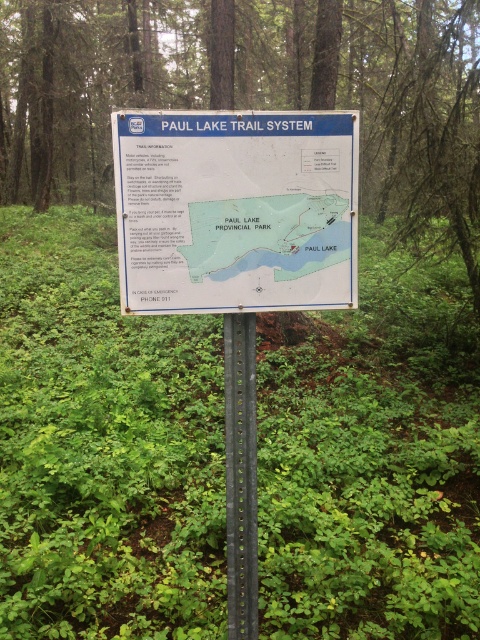
Question: Among these points, which one is farthest from the camera?

Choices:
 (A) (213, 220)
 (B) (97, 157)
 (C) (131, 292)
 (D) (239, 376)

Answer: (B)

Question: Among these points, which one is farthest from the camera?

Choices:
 (A) (254, 621)
 (B) (302, 268)

Answer: (A)

Question: Can you confirm if green leafy tree at center is positioned below white paper sign at center?

Choices:
 (A) yes
 (B) no

Answer: (B)

Question: Does green leafy tree at center have a smaller size compared to white paper map at center?

Choices:
 (A) no
 (B) yes

Answer: (A)

Question: Does white paper sign at center have a lesser width compared to white paper map at center?

Choices:
 (A) no
 (B) yes

Answer: (A)

Question: Which point appears closest to the camera in this image?

Choices:
 (A) (408, 4)
 (B) (340, 214)
 (C) (243, 403)

Answer: (B)